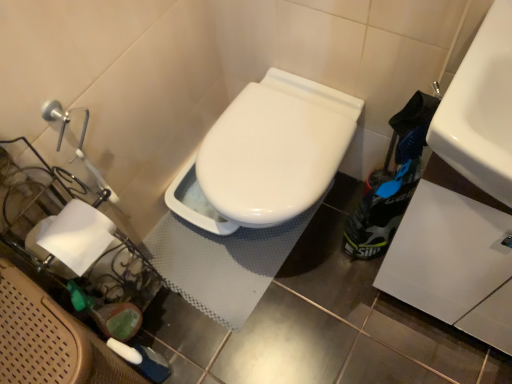
Question: Considering the relative sizes of white paper at left and white glossy sink at upper right in the image provided, is white paper at left shorter than white glossy sink at upper right?

Choices:
 (A) yes
 (B) no

Answer: (A)

Question: Can white glossy sink at upper right be found inside white paper at left?

Choices:
 (A) no
 (B) yes

Answer: (A)

Question: Is white paper at left to the left of white glossy sink at upper right from the viewer's perspective?

Choices:
 (A) no
 (B) yes

Answer: (B)

Question: Is there a large distance between white paper at left and white glossy sink at upper right?

Choices:
 (A) yes
 (B) no

Answer: (B)

Question: From the image's perspective, is white paper at left on top of white glossy sink at upper right?

Choices:
 (A) no
 (B) yes

Answer: (A)

Question: Is white paper at left wider than white glossy sink at upper right?

Choices:
 (A) no
 (B) yes

Answer: (A)

Question: From the image's perspective, would you say white textured bath mat at center is shown under white paper at left?

Choices:
 (A) no
 (B) yes

Answer: (A)

Question: Is white textured bath mat at center positioned beyond the bounds of white paper at left?

Choices:
 (A) yes
 (B) no

Answer: (A)

Question: Is white paper at left a part of white textured bath mat at center?

Choices:
 (A) no
 (B) yes

Answer: (A)

Question: Is white textured bath mat at center taller than white paper at left?

Choices:
 (A) yes
 (B) no

Answer: (B)

Question: From the image's perspective, would you say white textured bath mat at center is positioned over white paper at left?

Choices:
 (A) yes
 (B) no

Answer: (A)

Question: Is white textured bath mat at center closer to the viewer compared to white paper at left?

Choices:
 (A) no
 (B) yes

Answer: (A)

Question: Can you confirm if white textured bath mat at center is shorter than white glossy sink at upper right?

Choices:
 (A) no
 (B) yes

Answer: (B)